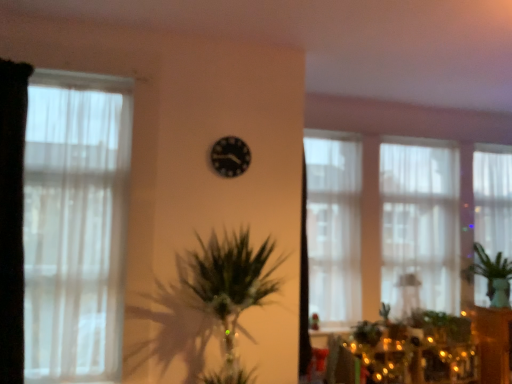
In order to face white sheer curtain at left, the 4th window when ordered from back to front, should I rotate leftwards or rightwards?

It's best to rotate left around 24.030 degrees.

What is the approximate width of translucent fabric window at center, positioned as the 3th window in back-to-front order?

translucent fabric window at center, positioned as the 3th window in back-to-front order, is 5.10 inches wide.

How much space does translucent fabric window at center, the 2th window when ordered from back to front, occupy horizontally?

The width of translucent fabric window at center, the 2th window when ordered from back to front, is 14.60 centimeters.

Image resolution: width=512 pixels, height=384 pixels. What do you see at coordinates (493, 198) in the screenshot? I see `translucent fabric window at right, the 4th window from the front` at bounding box center [493, 198].

This screenshot has height=384, width=512. Describe the element at coordinates (490, 274) in the screenshot. I see `green leafy plant at right` at that location.

At what (x,y) coordinates should I click in order to perform the action: click on black matte clock at center. Please return your answer as a coordinate pair (x, y). Image resolution: width=512 pixels, height=384 pixels. Looking at the image, I should click on (230, 156).

The width and height of the screenshot is (512, 384). Identify the location of white sheer curtain at left, the 4th window when ordered from back to front. (75, 225).

Between wooden cabinet at right and white sheer curtain at left, the 4th window when ordered from back to front, which one is positioned in front?

Positioned in front is white sheer curtain at left, the 4th window when ordered from back to front.

Which point is more forward, (x=487, y=359) or (x=73, y=228)?

Positioned in front is point (x=73, y=228).

From a real-world perspective, is wooden cabinet at right over white sheer curtain at left, which is the first window in front-to-back order?

No.

From the image's perspective, between translucent fabric window at center, positioned as the 2th window in right-to-left order, and illuminated string lights at lower right, which one is located above?

translucent fabric window at center, positioned as the 2th window in right-to-left order, appears higher in the image.

From a real-world perspective, relative to illuminated string lights at lower right, is translucent fabric window at center, the 2th window when ordered from back to front, vertically above or below?

translucent fabric window at center, the 2th window when ordered from back to front, is above illuminated string lights at lower right.

Who is taller, translucent fabric window at center, the 2th window when ordered from back to front, or illuminated string lights at lower right?

With more height is translucent fabric window at center, the 2th window when ordered from back to front.

Which point is more distant from viewer, (438, 269) or (453, 318)?

The point (438, 269) is more distant.

Consider the image. Based on their sizes in the image, would you say green leafy plant at right is bigger or smaller than illuminated string lights at lower right?

green leafy plant at right is bigger than illuminated string lights at lower right.

Considering the relative positions of green leafy plant at right and illuminated string lights at lower right in the image provided, is green leafy plant at right to the right of illuminated string lights at lower right from the viewer's perspective?

Yes.

Is green leafy plant at right placed right next to illuminated string lights at lower right?

No, green leafy plant at right is not making contact with illuminated string lights at lower right.

From a real-world perspective, is white sheer curtain at left, the 4th window when ordered from back to front, above or below translucent fabric window at right, the 4th window from the front?

Clearly, from a real-world perspective, white sheer curtain at left, the 4th window when ordered from back to front, is below translucent fabric window at right, the 4th window from the front.

Considering the positions of objects white sheer curtain at left, the 4th window when ordered from back to front, and translucent fabric window at right, which is counted as the 1th window, starting from the right, in the image provided, who is more to the right, white sheer curtain at left, the 4th window when ordered from back to front, or translucent fabric window at right, which is counted as the 1th window, starting from the right,?

translucent fabric window at right, which is counted as the 1th window, starting from the right.

Is white sheer curtain at left, the 1th window viewed from the left, wider than translucent fabric window at right, the 4th window from the front?

Yes.

Is translucent fabric window at center, the 2th window when ordered from front to back, completely or partially outside of black matte clock at center?

Absolutely, translucent fabric window at center, the 2th window when ordered from front to back, is external to black matte clock at center.

Is black matte clock at center at the back of translucent fabric window at center, the 3th window in the right-to-left sequence?

No, translucent fabric window at center, the 3th window in the right-to-left sequence,'s orientation is not away from black matte clock at center.

Which of these two, translucent fabric window at center, positioned as the 3th window in back-to-front order, or black matte clock at center, is bigger?

With larger size is translucent fabric window at center, positioned as the 3th window in back-to-front order.

Does point (332, 189) lie in front of point (211, 163)?

No, (332, 189) is further to viewer.

From the image's perspective, is black fabric curtain at left on top of black matte clock at center?

No, from the image's perspective, black fabric curtain at left is not over black matte clock at center.

Does point (18, 343) come in front of point (244, 165)?

That is True.

Does black fabric curtain at left appear on the right side of black matte clock at center?

Incorrect, black fabric curtain at left is not on the right side of black matte clock at center.

Is black fabric curtain at left situated inside black matte clock at center or outside?

black fabric curtain at left is located beyond the bounds of black matte clock at center.

Image resolution: width=512 pixels, height=384 pixels. In order to click on the 2nd window behind the illuminated string lights at lower right in this screenshot , I will do `click(419, 228)`.

In terms of size, does illuminated string lights at lower right appear bigger or smaller than translucent fabric window at center, which is the third window in front-to-back order?

Considering their sizes, illuminated string lights at lower right takes up less space than translucent fabric window at center, which is the third window in front-to-back order.

Is illuminated string lights at lower right touching translucent fabric window at center, positioned as the 2th window in right-to-left order?

No.

Where is `furniture lying below the white sheer curtain at left, which is the first window in front-to-back order (from the image's perspective)`? Image resolution: width=512 pixels, height=384 pixels. furniture lying below the white sheer curtain at left, which is the first window in front-to-back order (from the image's perspective) is located at coordinates (492, 343).

Locate an element on the screen. This screenshot has height=384, width=512. the 1st window above the illuminated string lights at lower right (from the image's perspective) is located at coordinates (419, 228).

Looking at the image, which one is located closer to translucent fabric window at center, positioned as the 2th window in right-to-left order, wooden cabinet at right or illuminated string lights at lower right?

illuminated string lights at lower right is positioned closer to the anchor translucent fabric window at center, positioned as the 2th window in right-to-left order.

Considering their positions, is wooden cabinet at right positioned closer to green leafy plant at right than translucent fabric window at center, which is the third window in front-to-back order?

wooden cabinet at right lies closer to green leafy plant at right than the other object.

Estimate the real-world distances between objects in this image. Which object is closer to black matte clock at center, wooden cabinet at right or green leafy plant at right?

green leafy plant at right.

When comparing their distances from green leafy plant at right, does translucent fabric window at right, the 4th window from the front, or translucent fabric window at center, positioned as the 2th window in right-to-left order, seem further?

translucent fabric window at center, positioned as the 2th window in right-to-left order, lies further to green leafy plant at right than the other object.

Based on their spatial positions, is black matte clock at center or white sheer curtain at left, the fourth window when ordered from right to left, further from illuminated string lights at lower right?

white sheer curtain at left, the fourth window when ordered from right to left, is positioned further to the anchor illuminated string lights at lower right.

When comparing their distances from wooden cabinet at right, does green leafy plant at right or translucent fabric window at right, the 4th window from the front, seem closer?

green leafy plant at right is closer to wooden cabinet at right.

Consider the image. Considering their positions, is black fabric curtain at left positioned further to illuminated string lights at lower right than wooden cabinet at right?

black fabric curtain at left.

From the image, which object appears to be nearer to black matte clock at center, translucent fabric window at center, positioned as the 2th window in right-to-left order, or black fabric curtain at left?

black fabric curtain at left lies closer to black matte clock at center than the other object.

This screenshot has height=384, width=512. What are the coordinates of `christmas decoration between white sheer curtain at left, the fourth window when ordered from right to left, and translucent fabric window at right, which is counted as the 1th window, starting from the right` in the screenshot? It's located at (408, 351).

Identify the location of furniture located between white sheer curtain at left, which is the first window in front-to-back order, and translucent fabric window at right, placed as the 1th window when sorted from back to front, in the left-right direction. The image size is (512, 384). (492, 343).

Identify the location of plant between black matte clock at center and translucent fabric window at right, the 4th window from the front, from left to right. tap(490, 274).

I want to click on clock located between white sheer curtain at left, the 1th window viewed from the left, and translucent fabric window at right, which is counted as the 1th window, starting from the right, in the left-right direction, so click(230, 156).